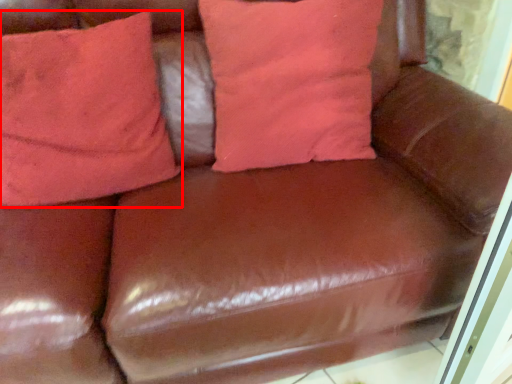
Question: Observing the image, what is the correct spatial positioning of pillow (annotated by the red box) in reference to pillow?

Choices:
 (A) left
 (B) right

Answer: (A)